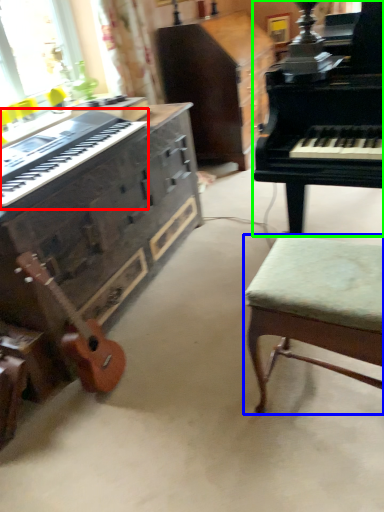
Question: Which is nearer to the musical keyboard (highlighted by a red box)? stool (highlighted by a blue box) or piano (highlighted by a green box).

Choices:
 (A) stool
 (B) piano

Answer: (B)